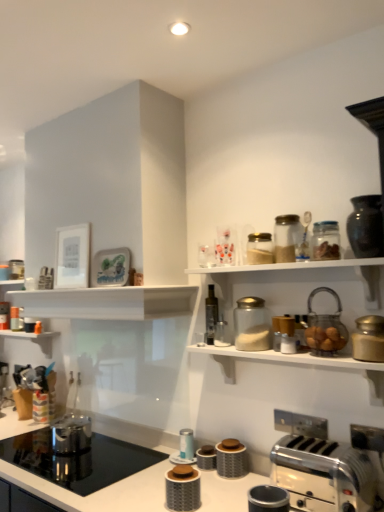
Question: From a real-world perspective, relative to metallic silver canister at center, marked as the 9th appliance in a right-to-left arrangement, is metallic silver toaster at lower right, which ranks as the seventh appliance in right-to-left order, vertically above or below?

Choices:
 (A) above
 (B) below

Answer: (A)

Question: Is metallic silver toaster at lower right, which ranks as the 6th appliance in left-to-right order, wider or thinner than metallic silver canister at center, marked as the 9th appliance in a right-to-left arrangement?

Choices:
 (A) thin
 (B) wide

Answer: (B)

Question: Estimate the real-world distances between objects in this image. Which object is farther from the metallic silver canister at center, the 10th appliance positioned from the right?

Choices:
 (A) transparent glass jar at upper center, which is the 7th appliance in left-to-right order
 (B) clear glass jar at upper right, the third appliance viewed from the right
 (C) metallic silver canister at lower center, the second appliance when ordered from left to right
 (D) metallic silver toaster at lower right, which is the 9th appliance from left to right
 (E) translucent glass jar at upper right, positioned as the second glass jar in back-to-front order

Answer: (E)

Question: Estimate the real-world distances between objects in this image. Which object is farther from the metallic silver canister at lower center, the second appliance when ordered from left to right?

Choices:
 (A) translucent glass jar at upper right, arranged as the second glass jar when viewed from the front
 (B) white glossy shelf at upper center, positioned as the first shelf in right-to-left order
 (C) metallic silver canister at center, marked as the fourth appliance in a left-to-right arrangement
 (D) gold metallic canister at upper right, the eleventh appliance positioned from the left
 (E) clear glass jar at upper right, which is the 10th appliance in left-to-right order

Answer: (A)